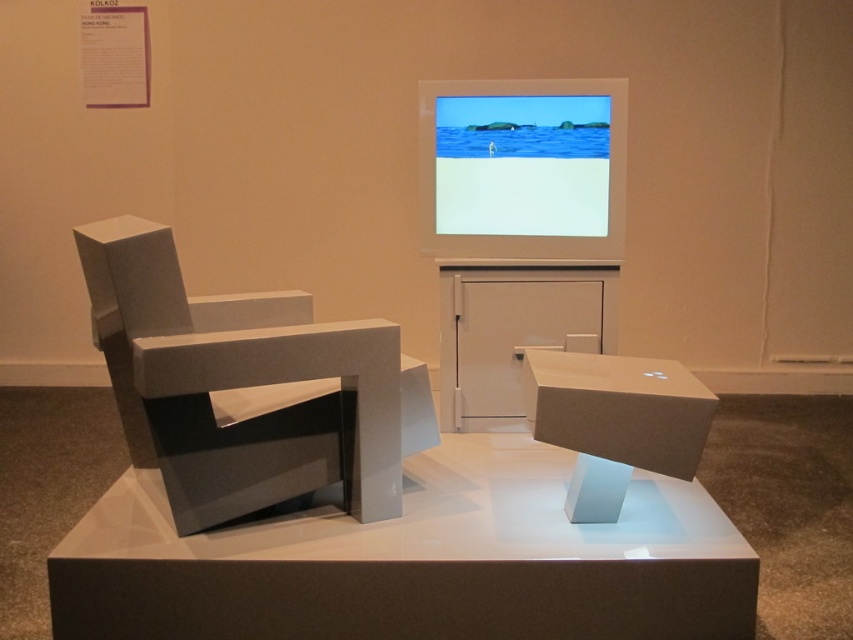
Who is positioned more to the left, matte gray chair at center or white cardboard box at center?

matte gray chair at center

Can you confirm if matte gray chair at center is taller than white cardboard box at center?

No, matte gray chair at center is not taller than white cardboard box at center.

The image size is (853, 640). In order to click on matte gray chair at center in this screenshot , I will do `click(418, 563)`.

Can you confirm if matte gray armchair at left is thinner than matte plastic screen at upper center?

No.

Between point (254, 312) and point (544, 166), which one is positioned in front?

Positioned in front is point (254, 312).

Between point (131, 413) and point (500, 132), which one is positioned in front?

Point (131, 413) is in front.

Where is `matte gray armchair at left`? The image size is (853, 640). matte gray armchair at left is located at coordinates pos(247,388).

Consider the image. Measure the distance between matte gray chair at center and matte gray armchair at left.

matte gray chair at center and matte gray armchair at left are 14.26 inches apart from each other.

Which is in front, point (456, 460) or point (393, 390)?

Point (393, 390) is more forward.

Where is `matte gray chair at center`? The image size is (853, 640). matte gray chair at center is located at coordinates (418, 563).